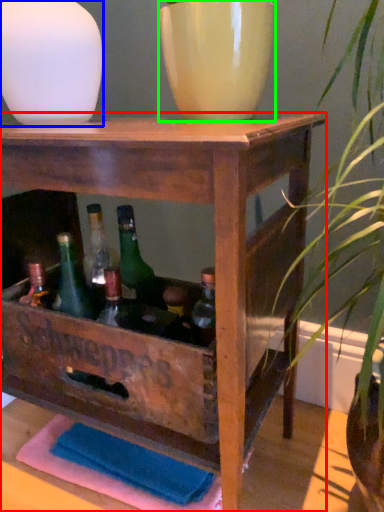
Question: Based on their relative distances, which object is farther from table (highlighted by a red box)? Choose from vase (highlighted by a blue box) and flowerpot (highlighted by a green box).

Choices:
 (A) vase
 (B) flowerpot

Answer: (A)